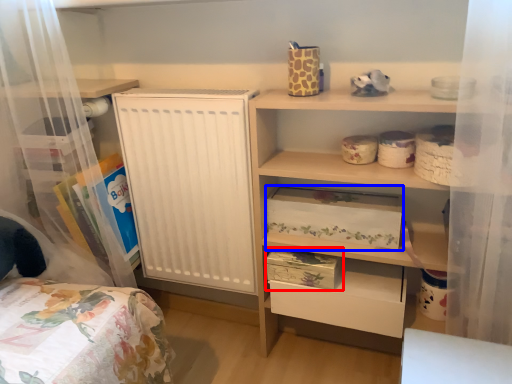
Question: Among these objects, which one is nearest to the camera, storage box (highlighted by a red box) or storage box (highlighted by a blue box)?

Choices:
 (A) storage box
 (B) storage box

Answer: (B)